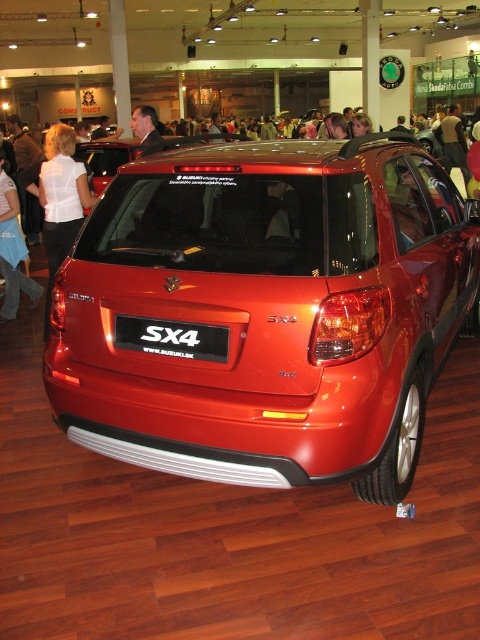
You are standing in the exhibition hall and see the point marked at coordinates (267, 310). What object is located at that point?

The glossy metallic suv at center is located at point (267, 310).

You are at an auto show and see the white plastic license plate at center and the white fabric shirt at upper left. Which object is nearer to you?

The white plastic license plate at center is closer to the viewer than the white fabric shirt at upper left.

You are a photographer at the auto show and need to capture a photo of the red Suzuki SX4 car. There are two jackets hanging on a rack at the upper center of the scene. The matte black jacket at upper center and the dark suit jacket at upper center. You want to ensure that both jackets are in focus in your photo. The depth of field of your camera can cover 10 meters. Will both jackets be in focus?

The matte black jacket at upper center and the dark suit jacket at upper center are 10.57 meters apart. Since the depth of field of your camera can only cover 10 meters, the distance between them exceeds the camera setting. Therefore, both jackets cannot be in focus simultaneously.